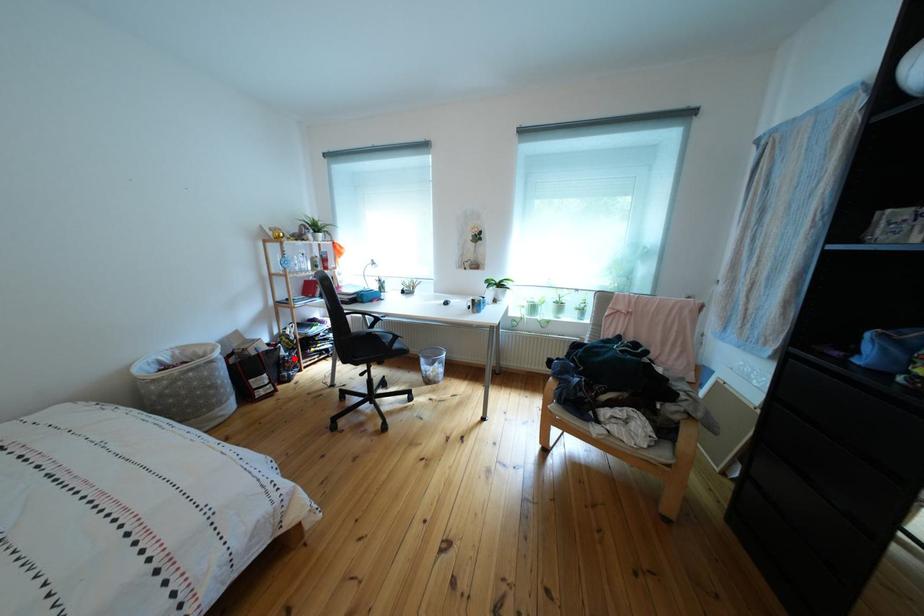
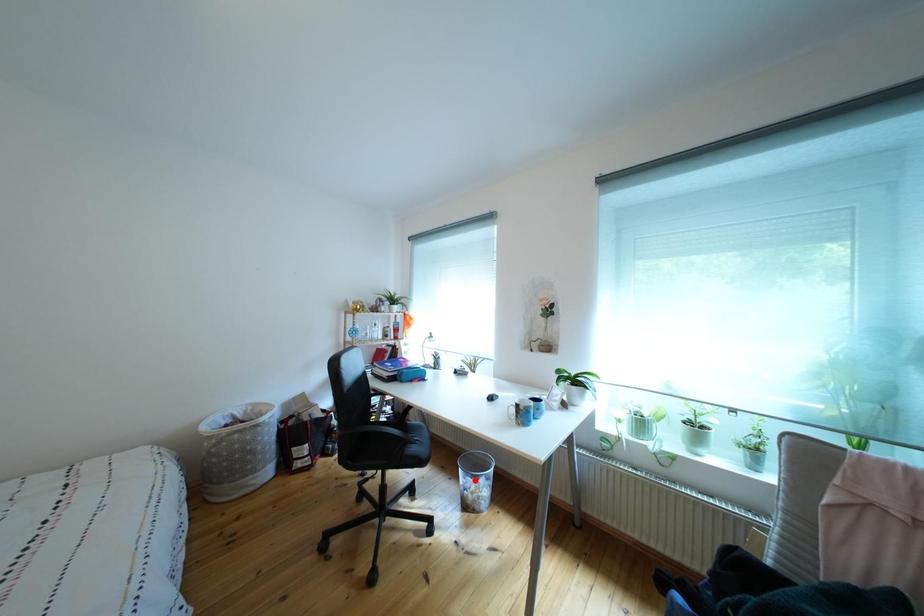
I am providing you with two images of the same scene from different viewpoints. A red point is marked on the first image and another point is marked on the second image. Is the marked point in image1 the same physical position as the marked point in image2?

No